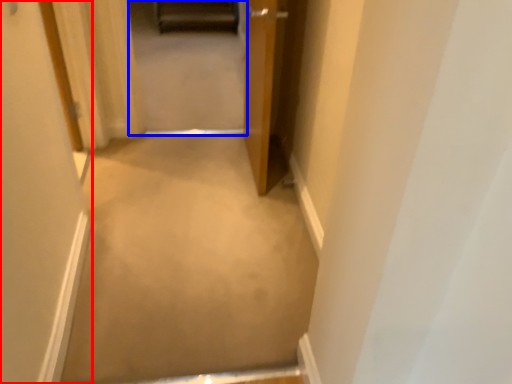
Question: Which object is closer to the camera taking this photo, door (highlighted by a red box) or passage (highlighted by a blue box)?

Choices:
 (A) door
 (B) passage

Answer: (A)